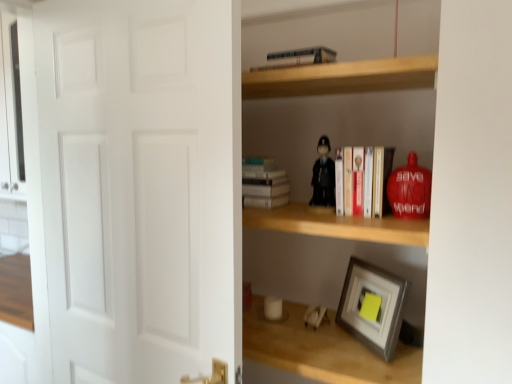
Question: Considering their positions, is wooden shelf at lower right, positioned as the 1th shelf in bottom-to-top order, located in front of or behind white plastic toy at lower center, the first toy when ordered from back to front?

Choices:
 (A) behind
 (B) front

Answer: (B)

Question: Does point (420, 316) appear closer or farther from the camera than point (312, 324)?

Choices:
 (A) closer
 (B) farther

Answer: (A)

Question: Which object is the farthest from the white matte door at left?

Choices:
 (A) wooden shelf at center, the first shelf when ordered from top to bottom
 (B) white matte stack of books at upper center
 (C) metallic silver train at upper center, marked as the second book in a bottom-to-top arrangement
 (D) wooden shelf at lower right, the second shelf from the top
 (E) hardcover books at center, arranged as the first book when ordered from the bottom

Answer: (D)

Question: Which of these objects is positioned closest to the white matte stack of books at upper center?

Choices:
 (A) white plastic toy at lower center, the first toy positioned from the bottom
 (B) hardcover books at center, positioned as the first book in right-to-left order
 (C) white matte door at left
 (D) matte black figurine at center, which appears as the 3th toy when ordered from the bottom
 (E) wooden shelf at upper center

Answer: (D)